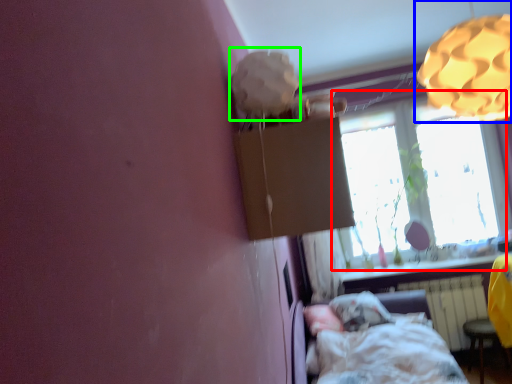
Question: Based on their relative distances, which object is nearer to window (highlighted by a red box)? Choose from lamp (highlighted by a blue box) and lamp (highlighted by a green box).

Choices:
 (A) lamp
 (B) lamp

Answer: (A)